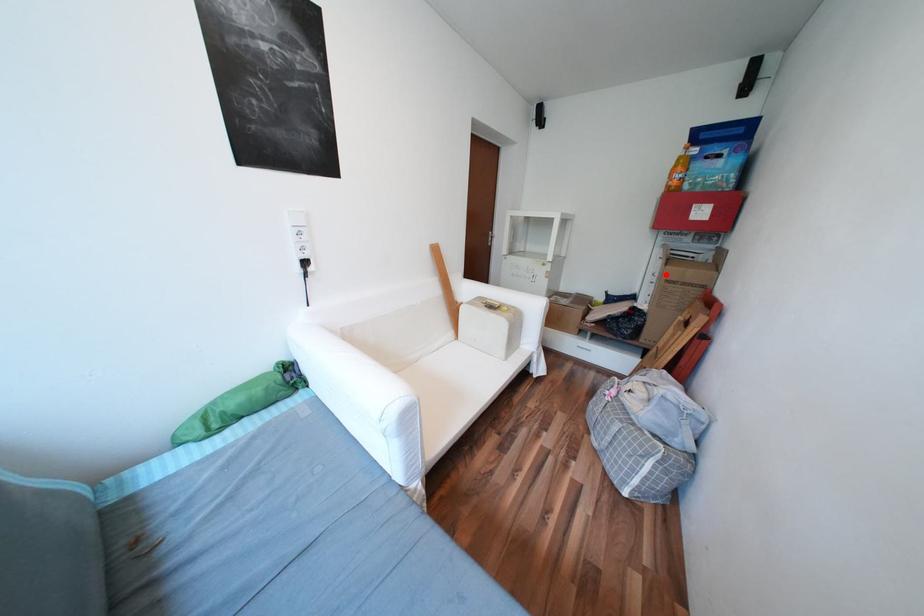
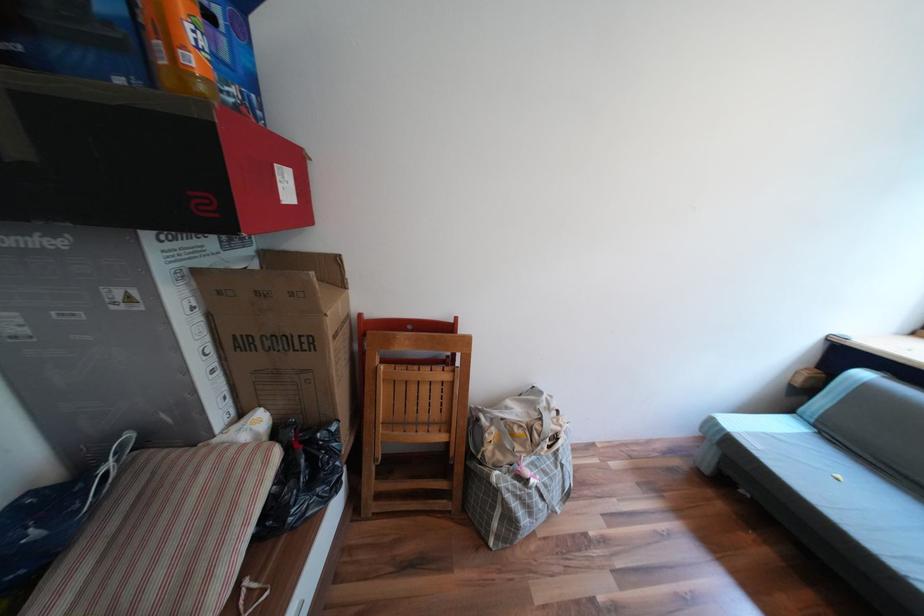
Question: I am providing you with two images of the same scene from different viewpoints. Image1 has a red point marked. In image2, the corresponding 3D location appears at what relative position? Reply with the corresponding letter.

Choices:
 (A) Closer
 (B) Farther

Answer: (B)